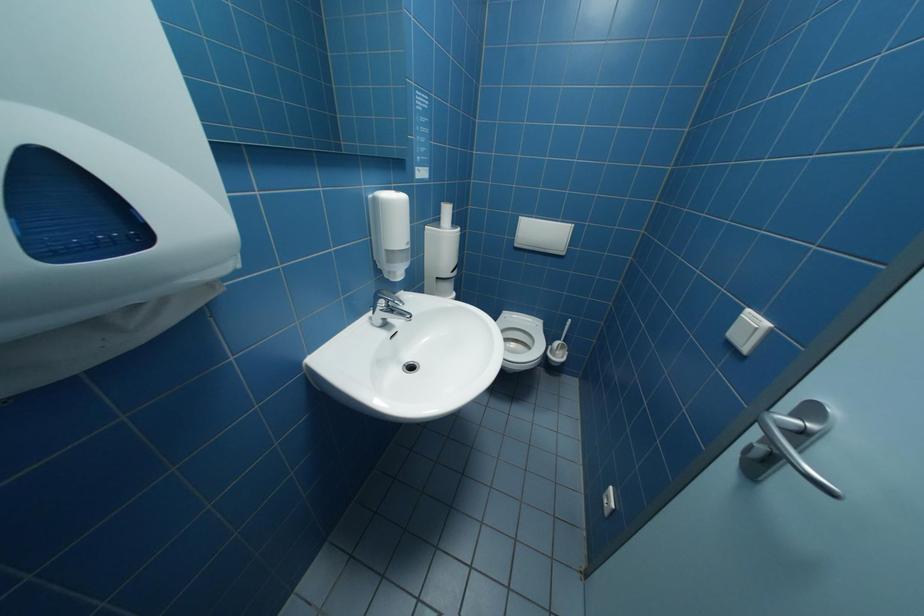
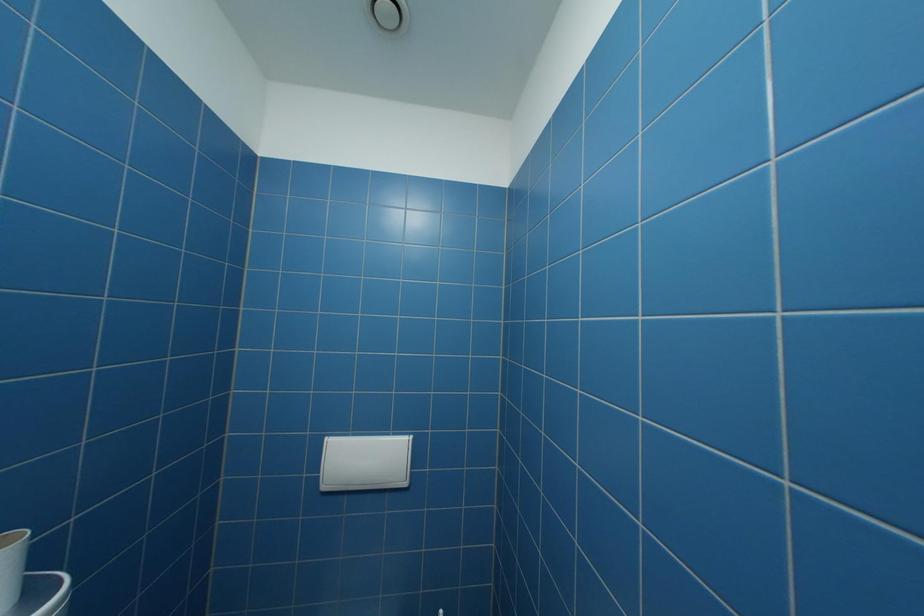
From the picture: How did the camera likely rotate?

The rotation direction of the camera is right-up.